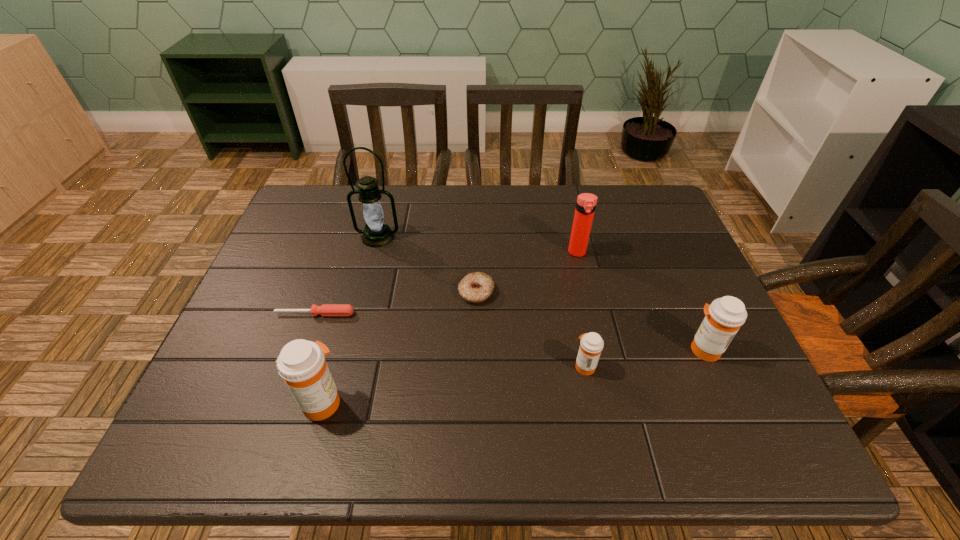
Where is `object present at the left edge`? The image size is (960, 540). object present at the left edge is located at coordinates (326, 309).

Locate an element on the screen. The width and height of the screenshot is (960, 540). object present at the right edge is located at coordinates (723, 318).

This screenshot has height=540, width=960. In the image, there is a desktop. Find the location of `vacant space at the far edge`. vacant space at the far edge is located at coordinates (425, 192).

The image size is (960, 540). I want to click on free space at the near edge of the desktop, so click(514, 404).

The width and height of the screenshot is (960, 540). Identify the location of vacant space at the left edge of the desktop. (321, 237).

The image size is (960, 540). I want to click on free space at the right edge of the desktop, so click(733, 359).

The width and height of the screenshot is (960, 540). Identify the location of free location at the far left corner of the desktop. (314, 208).

Locate an element on the screen. free space at the far right corner is located at coordinates (661, 201).

Identify the location of vacant space at the near right corner of the desktop. Image resolution: width=960 pixels, height=540 pixels. (731, 400).

Where is `empty location between the lantern and the screwdriver`? empty location between the lantern and the screwdriver is located at coordinates (347, 275).